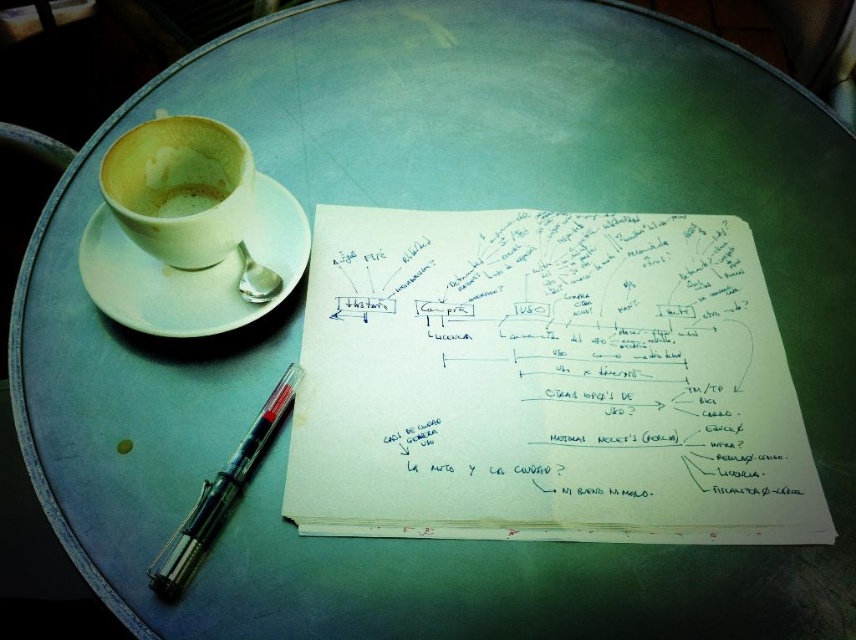
Who is shorter, white matte cup at upper left or light brown paper cup at left?

light brown paper cup at left

Can you confirm if white matte cup at upper left is taller than light brown paper cup at left?

Yes.

Locate an element on the screen. The image size is (856, 640). white matte cup at upper left is located at coordinates (180, 188).

This screenshot has height=640, width=856. Find the location of `white matte cup at upper left`. white matte cup at upper left is located at coordinates (180, 188).

Can you confirm if white paper at center is positioned below white ceramic saucer at upper left?

Correct, white paper at center is located below white ceramic saucer at upper left.

Image resolution: width=856 pixels, height=640 pixels. Identify the location of white paper at center. (545, 381).

Describe the element at coordinates (545, 381) in the screenshot. I see `white paper at center` at that location.

Find the location of `white paper at center`. white paper at center is located at coordinates (545, 381).

Can you confirm if white paper at center is thinner than light brown paper cup at left?

No, white paper at center is not thinner than light brown paper cup at left.

Is white paper at center below light brown paper cup at left?

Correct, white paper at center is located below light brown paper cup at left.

Where is `white paper at center`? This screenshot has width=856, height=640. white paper at center is located at coordinates (545, 381).